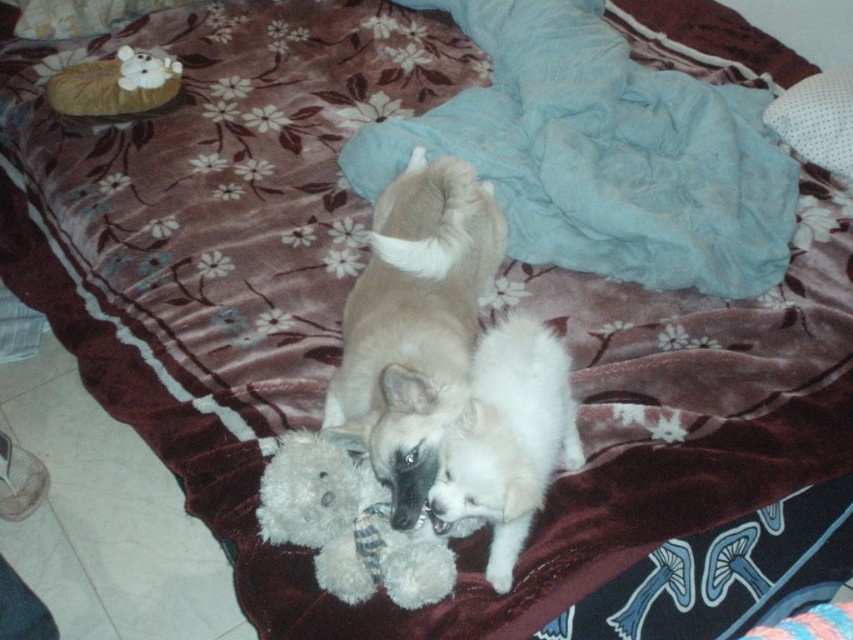
You are standing at the origin point of the coordinate system in the image. There are two points marked in the scene. Which point is closer to you, point (367,429) or point (47,1)?

Point (47,1) is closer to you because it is behind point (367,429), which is in front of it.

You are a guest in this room and want to know if the white fur dog at center is bigger than the white plush bear at upper left. Can you tell me?

The white fur dog at center is taller than white plush bear at upper left.